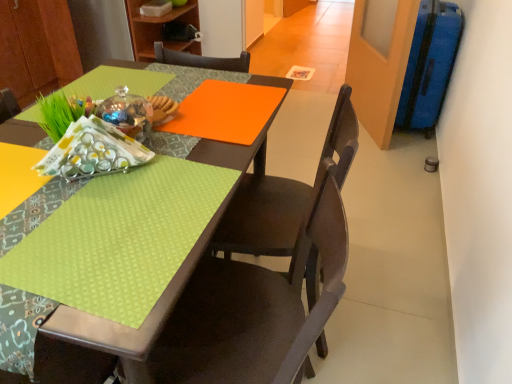
Question: Considering the relative sizes of lime green fabric at lower left and matte dark wood chair at center, arranged as the 1th chair when viewed from the back, in the image provided, is lime green fabric at lower left wider than matte dark wood chair at center, arranged as the 1th chair when viewed from the back,?

Choices:
 (A) no
 (B) yes

Answer: (A)

Question: Could you tell me if lime green fabric at lower left is facing matte dark wood chair at center, arranged as the 1th chair when viewed from the back?

Choices:
 (A) yes
 (B) no

Answer: (B)

Question: Can you confirm if lime green fabric at lower left is smaller than matte dark wood chair at center, which ranks as the second chair in front-to-back order?

Choices:
 (A) no
 (B) yes

Answer: (B)

Question: From a real-world perspective, does lime green fabric at lower left sit lower than matte dark wood chair at center, arranged as the 1th chair when viewed from the back?

Choices:
 (A) no
 (B) yes

Answer: (A)

Question: Is the depth of lime green fabric at lower left less than that of matte dark wood chair at center, arranged as the 1th chair when viewed from the back?

Choices:
 (A) yes
 (B) no

Answer: (A)

Question: Is wooden bookshelf at upper center bigger or smaller than lime green fabric at lower left?

Choices:
 (A) big
 (B) small

Answer: (A)

Question: From a real-world perspective, is wooden bookshelf at upper center above or below lime green fabric at lower left?

Choices:
 (A) above
 (B) below

Answer: (B)

Question: Which is correct: wooden bookshelf at upper center is inside lime green fabric at lower left, or outside of it?

Choices:
 (A) inside
 (B) outside

Answer: (B)

Question: In the image, is wooden bookshelf at upper center on the left side or the right side of lime green fabric at lower left?

Choices:
 (A) right
 (B) left

Answer: (B)

Question: Is matte brown chair at lower center, acting as the 1th chair starting from the front, taller or shorter than matte dark wood chair at center, which ranks as the second chair in front-to-back order?

Choices:
 (A) short
 (B) tall

Answer: (B)

Question: From the image's perspective, is matte brown chair at lower center, acting as the 1th chair starting from the front, located above or below matte dark wood chair at center, which ranks as the second chair in front-to-back order?

Choices:
 (A) below
 (B) above

Answer: (A)

Question: From a real-world perspective, is matte brown chair at lower center, the second chair in the back-to-front sequence, physically located above or below matte dark wood chair at center, arranged as the 1th chair when viewed from the back?

Choices:
 (A) below
 (B) above

Answer: (A)

Question: Considering their positions, is matte brown chair at lower center, the second chair in the back-to-front sequence, located in front of or behind matte dark wood chair at center, which ranks as the second chair in front-to-back order?

Choices:
 (A) behind
 (B) front

Answer: (B)

Question: Considering the positions of wooden bookshelf at upper center and matte brown chair at lower center, the second chair in the back-to-front sequence, in the image, is wooden bookshelf at upper center wider or thinner than matte brown chair at lower center, the second chair in the back-to-front sequence,?

Choices:
 (A) wide
 (B) thin

Answer: (A)

Question: Looking at the image, does wooden bookshelf at upper center seem bigger or smaller compared to matte brown chair at lower center, the second chair in the back-to-front sequence?

Choices:
 (A) big
 (B) small

Answer: (B)